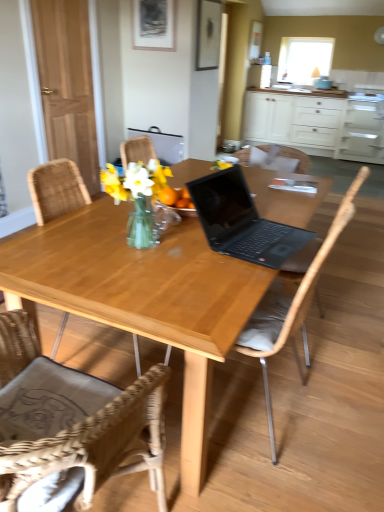
Question: Is wooden chair at center, which is the third chair from front to back, inside or outside of white matte cabinet at upper right?

Choices:
 (A) outside
 (B) inside

Answer: (A)

Question: From their relative heights in the image, would you say wooden chair at center, which is the third chair from front to back, is taller or shorter than white matte cabinet at upper right?

Choices:
 (A) tall
 (B) short

Answer: (B)

Question: Based on their relative distances, which object is farther from the transparent glass window screen at upper center?

Choices:
 (A) white matte cabinet at upper right
 (B) matte white armchair at upper center
 (C) wooden picture frame at upper center, acting as the 1th picture frame starting from the right
 (D) wooden chair at center, which is counted as the 2th chair, starting from the back
 (E) light wood table at center

Answer: (E)

Question: Which object is positioned closest to the matte black picture frame at upper center, which appears as the second picture frame when viewed from the right?

Choices:
 (A) translucent glass vase at center
 (B) woven rattan chair at lower left, which ranks as the third chair in back-to-front order
 (C) wooden picture frame at upper center, placed as the 2th picture frame when sorted from left to right
 (D) white matte cabinet at upper right
 (E) light wood table at center

Answer: (C)